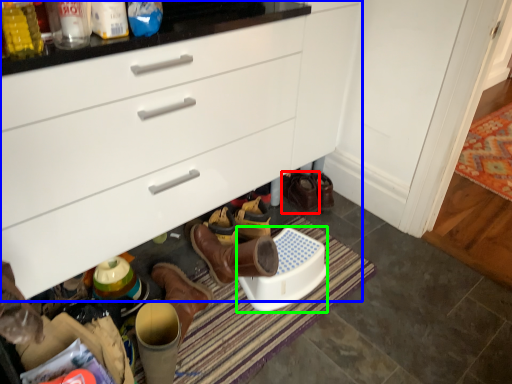
Question: Which is farther away from footwear (highlighted by a red box)? cabinetry (highlighted by a blue box) or corded phone (highlighted by a green box)?

Choices:
 (A) cabinetry
 (B) corded phone

Answer: (A)